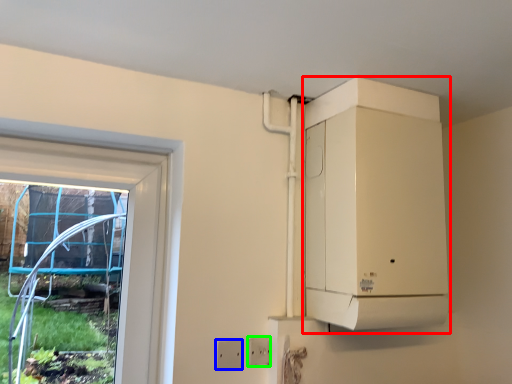
Question: Which is farther away from appliance (highlighted by a red box)? electric outlet (highlighted by a blue box) or electric outlet (highlighted by a green box)?

Choices:
 (A) electric outlet
 (B) electric outlet

Answer: (A)